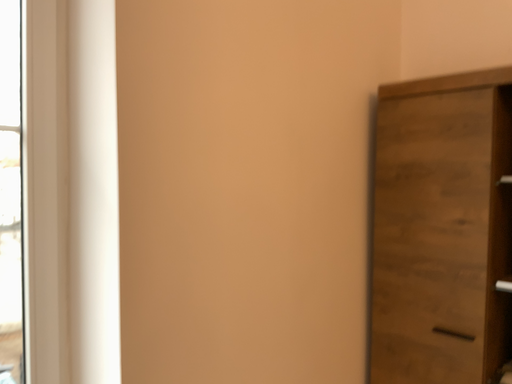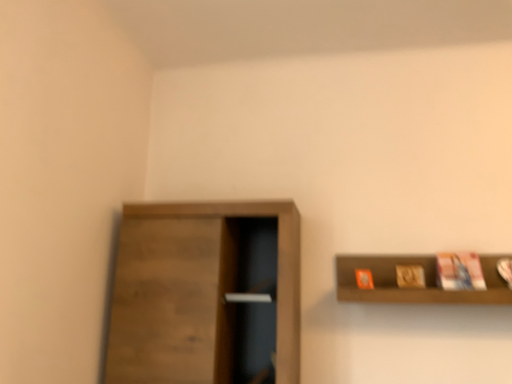
Question: How did the camera likely rotate when shooting the video?

Choices:
 (A) rotated left
 (B) rotated right

Answer: (B)